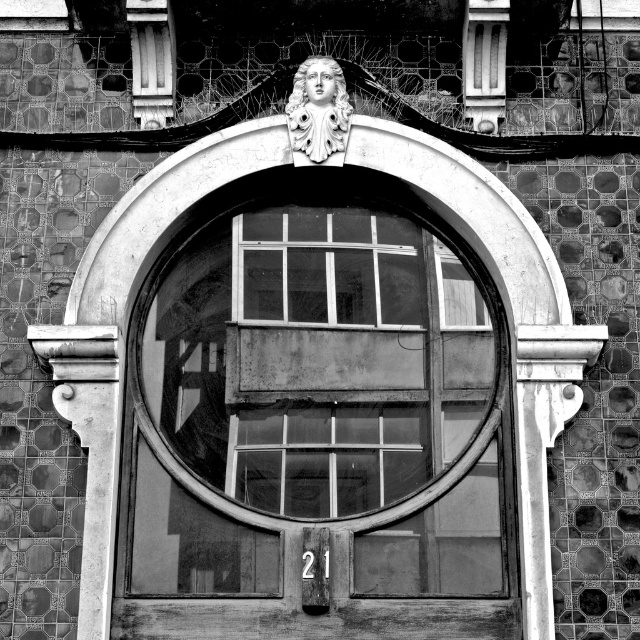
Question: Can you confirm if transparent glass window at center is smaller than matte stone face at upper center?

Choices:
 (A) no
 (B) yes

Answer: (A)

Question: Which point is farther to the camera?

Choices:
 (A) (280, 180)
 (B) (314, 99)

Answer: (A)

Question: From the image, what is the correct spatial relationship of transparent glass window at center in relation to matte stone face at upper center?

Choices:
 (A) above
 (B) below

Answer: (B)

Question: Considering the relative positions of transparent glass window at center and matte stone face at upper center in the image provided, where is transparent glass window at center located with respect to matte stone face at upper center?

Choices:
 (A) left
 (B) right

Answer: (A)